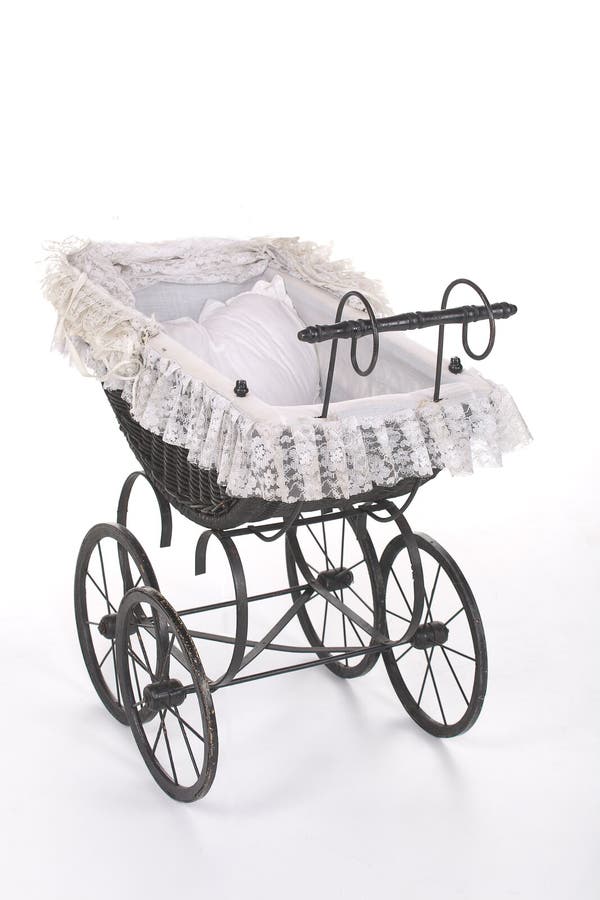
Identify the location of basket to hold the baby. Image resolution: width=600 pixels, height=900 pixels. (192, 472).